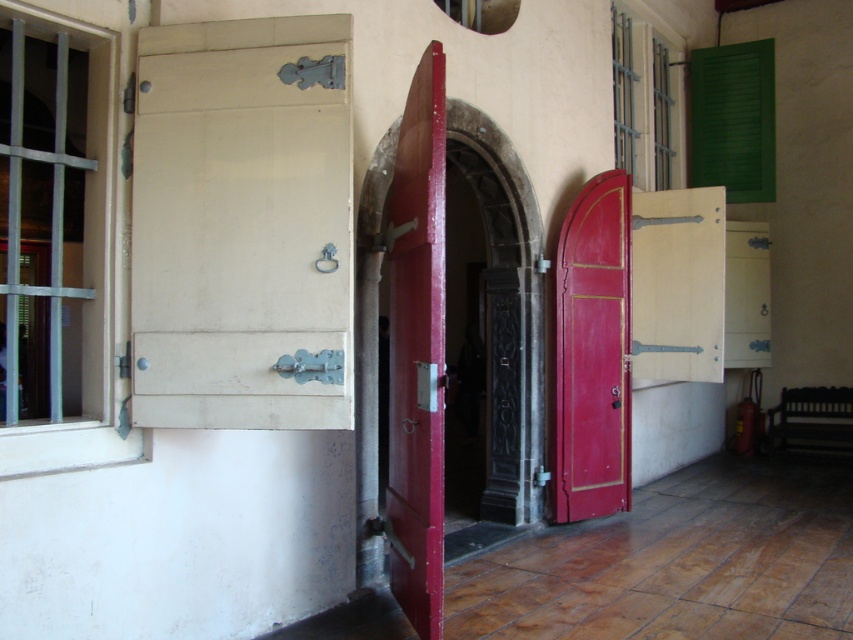
Can you confirm if glossy wood door at center right is taller than metallic silver shutter at upper right?

Correct, glossy wood door at center right is much taller as metallic silver shutter at upper right.

Between glossy wood door at center right and metallic silver shutter at upper right, which one has less height?

Standing shorter between the two is metallic silver shutter at upper right.

Locate an element on the screen. glossy wood door at center right is located at coordinates (593, 353).

Find the location of a particular element. glossy wood door at center right is located at coordinates (593, 353).

I want to click on smooth red door at center, so click(x=416, y=349).

What do you see at coordinates (416, 349) in the screenshot?
I see `smooth red door at center` at bounding box center [416, 349].

You are a GUI agent. You are given a task and a screenshot of the screen. Output one action in this format:
    pyautogui.click(x=<x>, y=<y>)
    Task: Click on the smooth red door at center
    
    Given the screenshot: What is the action you would take?
    pyautogui.click(x=416, y=349)

Does point (576, 396) come in front of point (753, 189)?

That is True.

Is glossy wood door at center right wider than green matte shutter at upper right?

No, glossy wood door at center right is not wider than green matte shutter at upper right.

This screenshot has height=640, width=853. Identify the location of glossy wood door at center right. (593, 353).